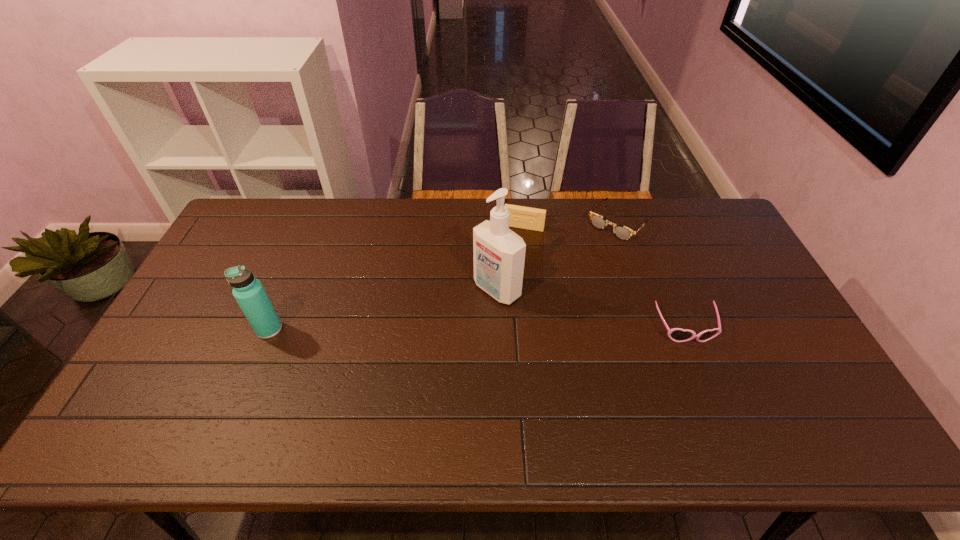
In the image, there is a desktop. At what (x,y) coordinates should I click in order to perform the action: click on vacant space at the far edge. Please return your answer as a coordinate pair (x, y). Looking at the image, I should click on (583, 211).

In the image, there is a desktop. Where is `free region at the near edge`? Image resolution: width=960 pixels, height=540 pixels. free region at the near edge is located at coordinates (719, 406).

In the image, there is a desktop. Identify the location of vacant region at the left edge. (196, 318).

The image size is (960, 540). In the image, there is a desktop. Find the location of `vacant space at the right edge`. vacant space at the right edge is located at coordinates (794, 336).

Find the location of `free location at the near left corner`. free location at the near left corner is located at coordinates (174, 380).

The image size is (960, 540). Find the location of `vacant area that lies between the third nearest object and the sunglasses`. vacant area that lies between the third nearest object and the sunglasses is located at coordinates (591, 309).

This screenshot has width=960, height=540. Find the location of `empty space between the third nearest object and the spectacles`. empty space between the third nearest object and the spectacles is located at coordinates (558, 256).

Find the location of a particular element. Image resolution: width=960 pixels, height=540 pixels. free space that is in between the third tallest object and the sunglasses is located at coordinates (604, 278).

Find the location of a particular element. Image resolution: width=960 pixels, height=540 pixels. vacant space that is in between the sunglasses and the spectacles is located at coordinates [x=652, y=276].

Where is `free spot between the thermos bottle and the videotape`? The height and width of the screenshot is (540, 960). free spot between the thermos bottle and the videotape is located at coordinates (396, 278).